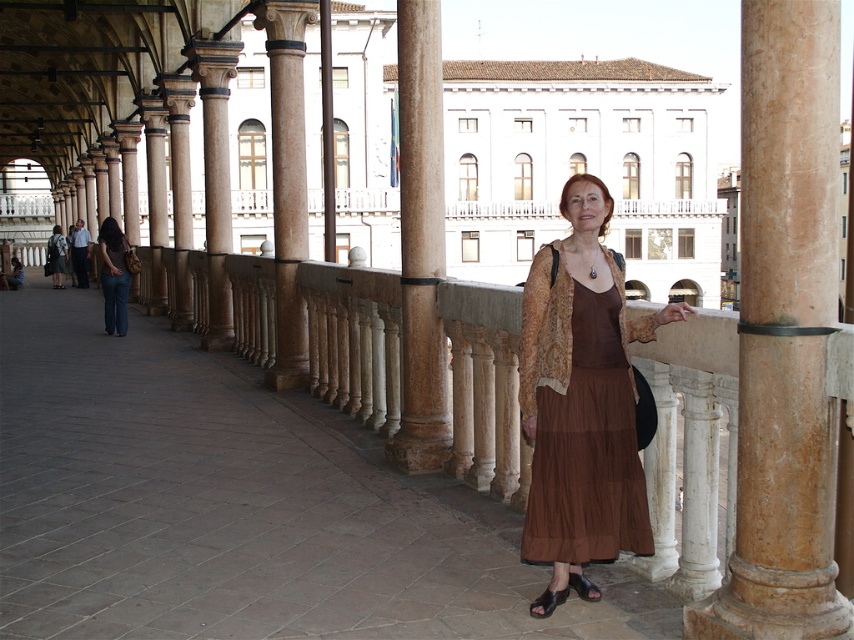
Question: Among these objects, which one is nearest to the camera?

Choices:
 (A) brown fabric rail at center
 (B) brown marble pillar at center
 (C) denim jeans at left
 (D) marble column at center

Answer: (B)

Question: Which point is farther from the camera taking this photo?

Choices:
 (A) (551, 605)
 (B) (799, 577)
 (C) (209, 236)

Answer: (C)

Question: Is brown polished stone column at center positioned in front of black leather sandal at lower center?

Choices:
 (A) no
 (B) yes

Answer: (A)

Question: Considering the real-world distances, which object is farthest from the brown marble pillar at center?

Choices:
 (A) shiny black leather sandal at lower center
 (B) brown fabric rail at center
 (C) denim jeans at left
 (D) marble column at center

Answer: (C)

Question: Is brown polished stone column at center to the right of black leather sandal at lower center from the viewer's perspective?

Choices:
 (A) yes
 (B) no

Answer: (B)

Question: Is marble column at center behind shiny black leather sandal at lower center?

Choices:
 (A) yes
 (B) no

Answer: (A)